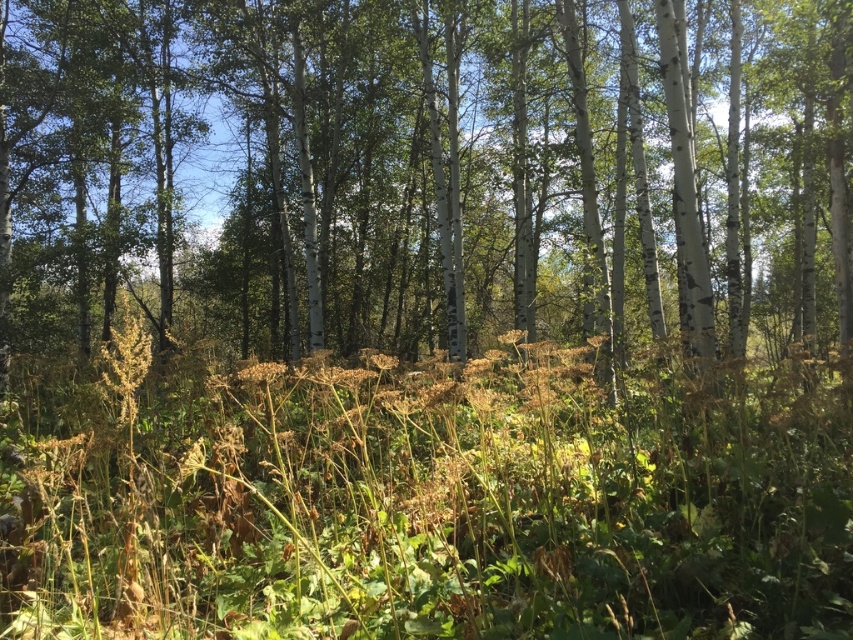
In the scene shown: How distant is white smooth tree at center from brown dry grass at center?

white smooth tree at center and brown dry grass at center are 4.45 meters apart from each other.

Does white smooth tree at center appear on the right side of brown dry grass at center?

Yes, white smooth tree at center is to the right of brown dry grass at center.

This screenshot has height=640, width=853. I want to click on white smooth tree at center, so click(x=434, y=172).